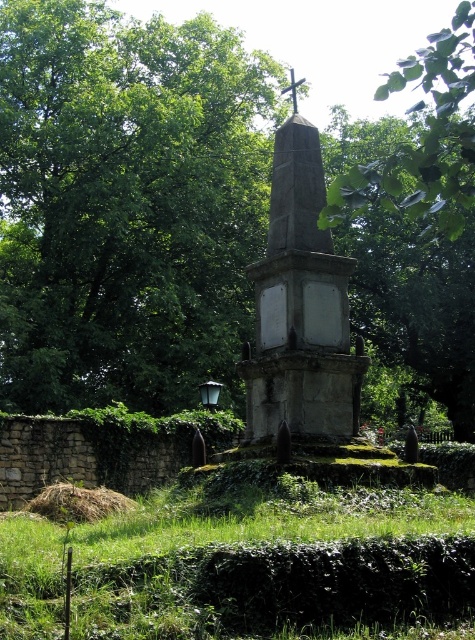
Question: Does green grass at lower center appear on the left side of gray stone monument at center?

Choices:
 (A) yes
 (B) no

Answer: (A)

Question: Is green leafy tree at center above gray stone monument at center?

Choices:
 (A) no
 (B) yes

Answer: (B)

Question: Which point is closer to the camera?

Choices:
 (A) (123, 282)
 (B) (106, 604)

Answer: (B)

Question: Does green grass at lower center have a greater width compared to gray stone monument at center?

Choices:
 (A) no
 (B) yes

Answer: (B)

Question: Which of the following is the closest to the observer?

Choices:
 (A) gray stone monument at center
 (B) green grass at lower center
 (C) green leafy tree at center

Answer: (B)

Question: Which point is closer to the camera taking this photo?

Choices:
 (A) (107, 632)
 (B) (370, 148)
 (C) (315, 227)

Answer: (A)